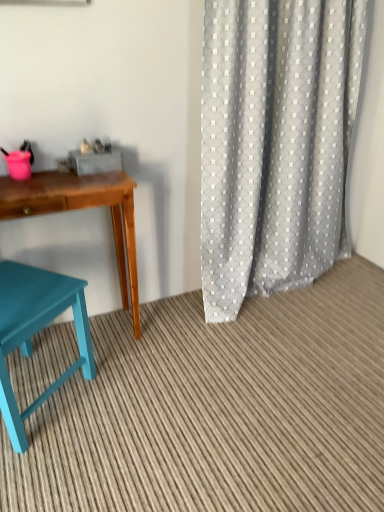
Locate an element on the screen. The image size is (384, 512). free space on the front side of teal wood desk at left is located at coordinates (102, 417).